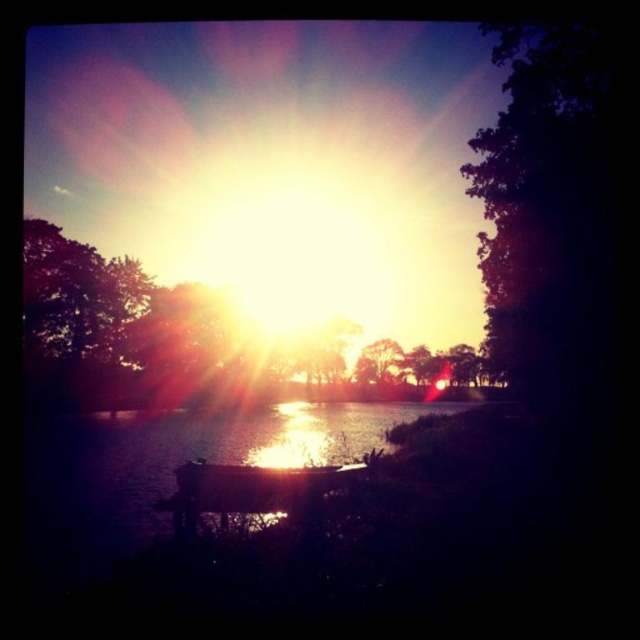
Question: Among these objects, which one is farthest from the camera?

Choices:
 (A) metallic silver boat at center
 (B) silvery metallic tree at center

Answer: (B)

Question: Which point is closer to the camera taking this photo?

Choices:
 (A) (582, 61)
 (B) (282, 481)
 (C) (394, 390)
 (D) (211, 452)

Answer: (B)

Question: Is glistening reflective water at center closer to camera compared to metallic silver boat at center?

Choices:
 (A) no
 (B) yes

Answer: (B)

Question: Among these objects, which one is farthest from the camera?

Choices:
 (A) silvery metallic tree at center
 (B) glistening reflective water at center

Answer: (A)

Question: Is glistening reflective water at center to the right of metallic silver boat at center from the viewer's perspective?

Choices:
 (A) yes
 (B) no

Answer: (B)

Question: Can you confirm if dark purple leafy tree at right is smaller than silvery metallic tree at center?

Choices:
 (A) no
 (B) yes

Answer: (B)